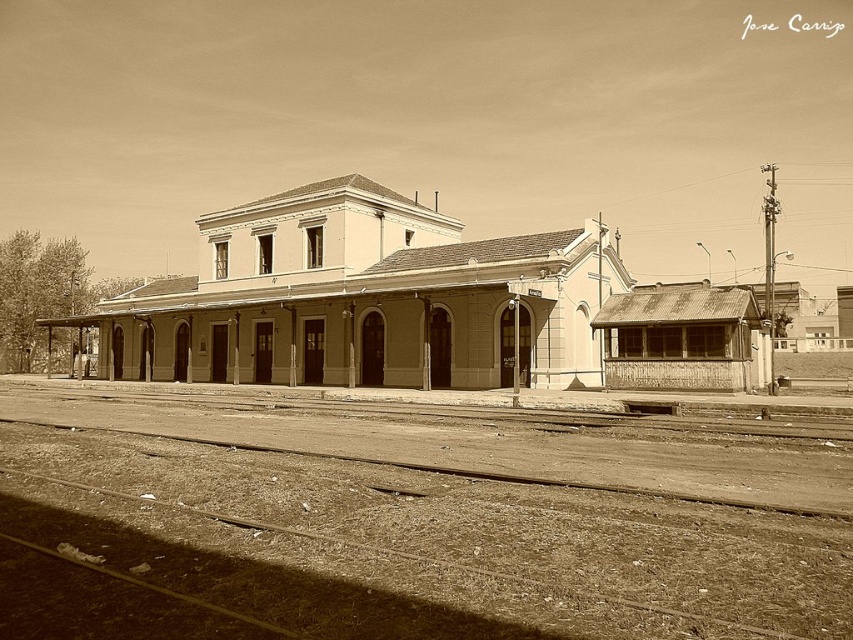
Between point (421, 474) and point (42, 422), which one is positioned in front?

Point (421, 474)

The image size is (853, 640). I want to click on brown dirt track at lower center, so click(413, 516).

Who is more forward, (x=554, y=468) or (x=697, y=496)?

Point (x=697, y=496) is in front.

Locate an element on the screen. The width and height of the screenshot is (853, 640). brown dirt track at lower center is located at coordinates (413, 516).